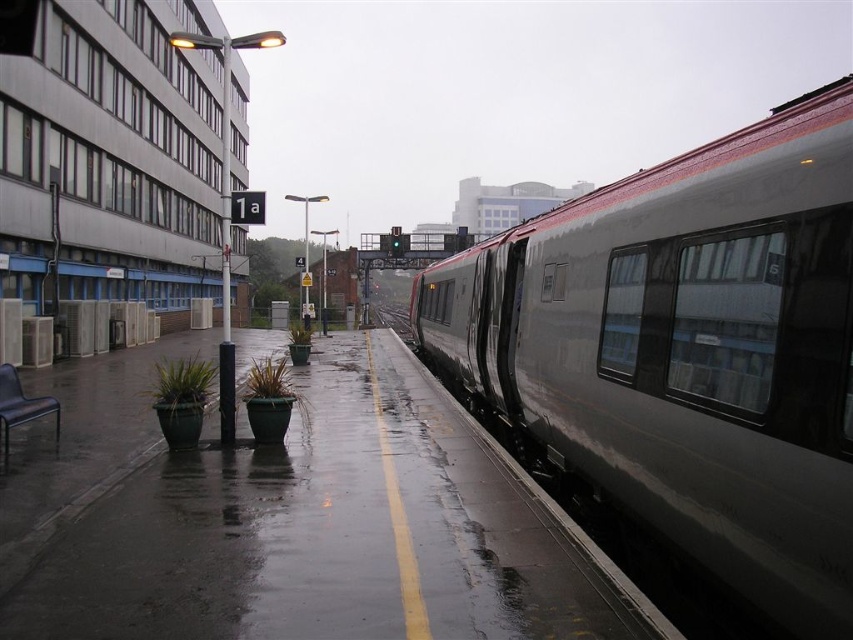
Does point (666, 316) come behind point (405, 324)?

No, it is not.

Can you confirm if metallic gray train at right is positioned above metal train track at center?

No.

Which is behind, point (822, 240) or point (390, 305)?

Point (390, 305)

Locate an element on the screen. The height and width of the screenshot is (640, 853). metallic gray train at right is located at coordinates (686, 353).